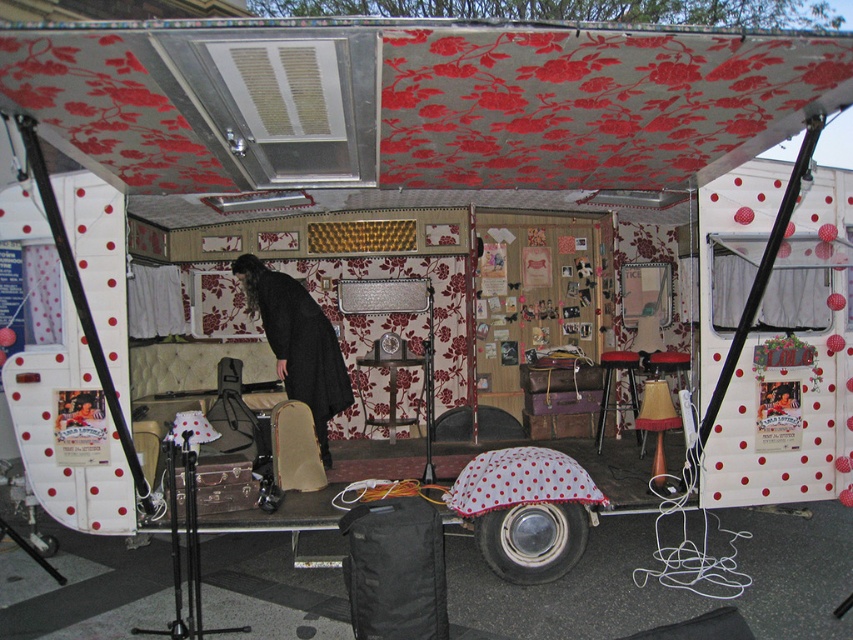
Question: Does white polka dot fabric umbrella at center come behind red fabric stool at center?

Choices:
 (A) yes
 (B) no

Answer: (B)

Question: Is white polka dot fabric umbrella at center wider than red fabric stool at center?

Choices:
 (A) no
 (B) yes

Answer: (B)

Question: Is white polka dot fabric umbrella at center bigger than red fabric stool at center?

Choices:
 (A) no
 (B) yes

Answer: (A)